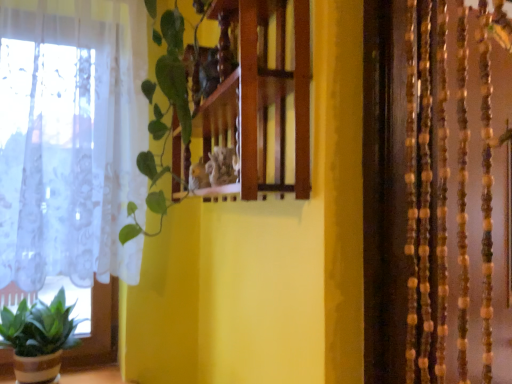
Locate an element on the screen. green leafy plant at center is located at coordinates [x=162, y=114].

Based on their positions, is green leafy plant at center located to the left or right of green matte plant at lower left?

Based on their positions, green leafy plant at center is located to the right of green matte plant at lower left.

Where is `houseplant below the green leafy plant at center (from a real-world perspective)`? The width and height of the screenshot is (512, 384). houseplant below the green leafy plant at center (from a real-world perspective) is located at coordinates (39, 338).

From the image's perspective, which is above, green leafy plant at center or green matte plant at lower left?

green leafy plant at center is shown above in the image.

Is wooden shelf at center turned away from green matte plant at lower left?

No, green matte plant at lower left is not at the back of wooden shelf at center.

Which is further, (283, 121) or (22, 356)?

Positioned behind is point (22, 356).

Based on the photo, is wooden shelf at center positioned far away from green matte plant at lower left?

No, wooden shelf at center is in close proximity to green matte plant at lower left.

Choose the correct answer: Is wooden shelf at center inside green matte plant at lower left or outside it?

wooden shelf at center lies outside green matte plant at lower left.

Considering the relative positions of green matte plant at lower left and green leafy plant at center in the image provided, is green matte plant at lower left behind green leafy plant at center?

Yes, green matte plant at lower left is behind green leafy plant at center.

Is green matte plant at lower left bigger than green leafy plant at center?

Incorrect, green matte plant at lower left is not larger than green leafy plant at center.

Which is in front, point (12, 319) or point (169, 104)?

The point (169, 104) is closer to the camera.

How far apart are green matte plant at lower left and green leafy plant at center?

green matte plant at lower left is 73.18 centimeters from green leafy plant at center.

Does green leafy plant at center have a greater height compared to wooden shelf at center?

Indeed, green leafy plant at center has a greater height compared to wooden shelf at center.

From a real-world perspective, between green leafy plant at center and wooden shelf at center, who is vertically higher?

wooden shelf at center is physically above.

Who is more distant, green leafy plant at center or wooden shelf at center?

green leafy plant at center is more distant.

Is point (148, 83) more distant than point (220, 63)?

Yes, it is.

Where is `shelf positioned vertically above the green matte plant at lower left (from a real-world perspective)`? shelf positioned vertically above the green matte plant at lower left (from a real-world perspective) is located at coordinates (261, 97).

How different are the orientations of green matte plant at lower left and wooden shelf at center in degrees?

There is a 90-degree angle between the facing directions of green matte plant at lower left and wooden shelf at center.

Is green matte plant at lower left with wooden shelf at center?

No.

Considering the positions of objects green matte plant at lower left and wooden shelf at center in the image provided, who is more to the left, green matte plant at lower left or wooden shelf at center?

From the viewer's perspective, green matte plant at lower left appears more on the left side.

What's the angular difference between wooden shelf at center and green leafy plant at center's facing directions?

The facing directions of wooden shelf at center and green leafy plant at center are 0.00114 degrees apart.

Is wooden shelf at center with green leafy plant at center?

No, wooden shelf at center is not next to green leafy plant at center.

Is point (289, 25) farther from camera compared to point (189, 104)?

No.

Visually, is wooden shelf at center positioned to the left or to the right of green leafy plant at center?

From the image, it's evident that wooden shelf at center is to the right of green leafy plant at center.

Find the location of a particular element. houseplant below the green leafy plant at center (from the image's perspective) is located at coordinates (39, 338).

Where is `shelf above the green matte plant at lower left (from the image's perspective)`? The image size is (512, 384). shelf above the green matte plant at lower left (from the image's perspective) is located at coordinates (261, 97).

From the image, which object appears to be nearer to green leafy plant at center, green matte plant at lower left or wooden shelf at center?

The object closer to green leafy plant at center is wooden shelf at center.

When comparing their distances from green leafy plant at center, does wooden shelf at center or green matte plant at lower left seem closer?

The object closer to green leafy plant at center is wooden shelf at center.

Considering their positions, is green leafy plant at center positioned further to wooden shelf at center than green matte plant at lower left?

green matte plant at lower left lies further to wooden shelf at center than the other object.

From the image, which object appears to be farther from wooden shelf at center, green matte plant at lower left or green leafy plant at center?

green matte plant at lower left is further to wooden shelf at center.

When comparing their distances from green matte plant at lower left, does wooden shelf at center or green leafy plant at center seem closer?

green leafy plant at center lies closer to green matte plant at lower left than the other object.

Considering their positions, is green leafy plant at center positioned closer to green matte plant at lower left than wooden shelf at center?

Among the two, green leafy plant at center is located nearer to green matte plant at lower left.

Where is `vegetation between wooden shelf at center and green matte plant at lower left vertically`? vegetation between wooden shelf at center and green matte plant at lower left vertically is located at coordinates (162, 114).